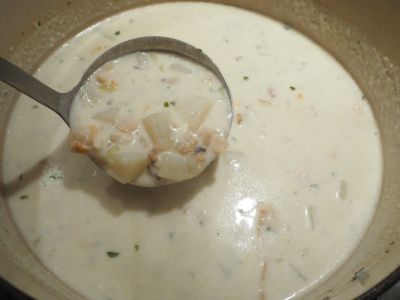
Find the location of a particular element. The width and height of the screenshot is (400, 300). handle of gray metal soup ladle is located at coordinates (24, 85).